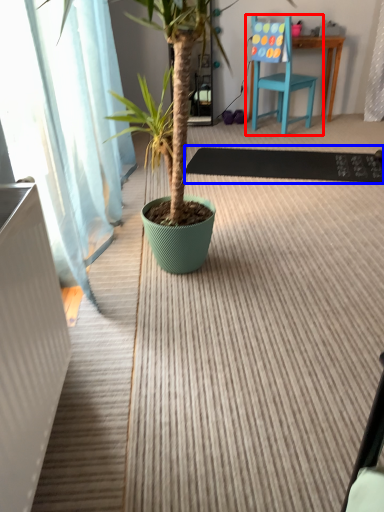
Question: Among these objects, which one is nearest to the camera, chair (highlighted by a red box) or doormat (highlighted by a blue box)?

Choices:
 (A) chair
 (B) doormat

Answer: (B)